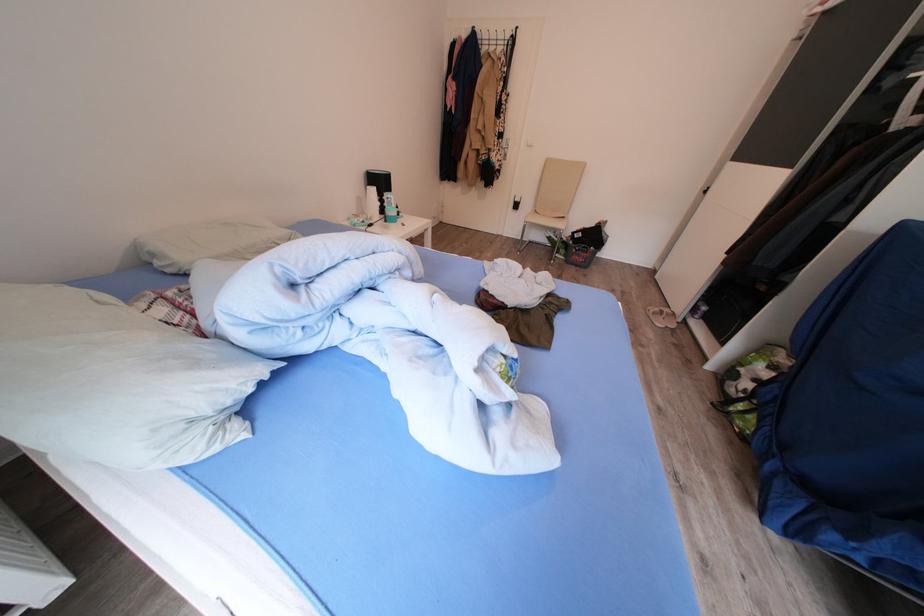
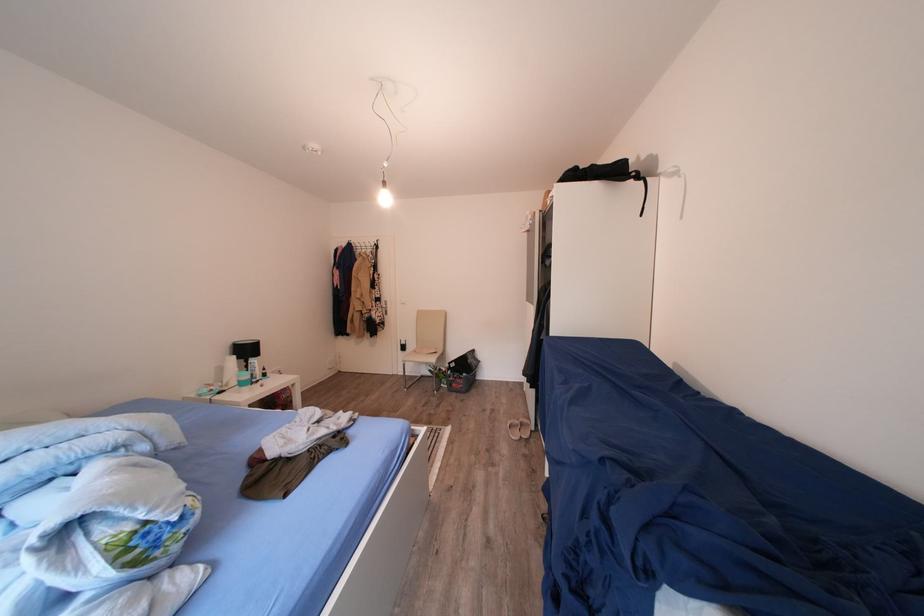
Find the pixel in the second image that matches [665,315] in the first image.

(526, 427)